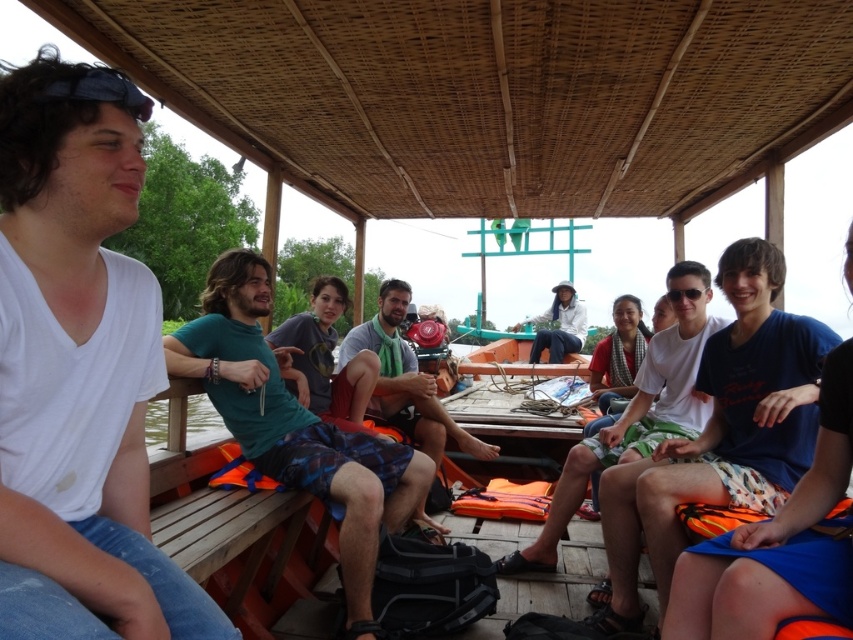
Question: Which is nearer to the blue cotton shorts at center?

Choices:
 (A) white fabric shirt at center
 (B) green fabric shorts at center
 (C) green fabric scarf at center
 (D) white cotton shirt at center

Answer: (D)

Question: Which object appears farthest from the camera in this image?

Choices:
 (A) green fabric shorts at center
 (B) white cotton shirt at left
 (C) white fabric shirt at center
 (D) blue cotton shorts at center

Answer: (C)

Question: Is white cotton shirt at left positioned behind white fabric shirt at center?

Choices:
 (A) no
 (B) yes

Answer: (A)

Question: Does green fabric shorts at center appear under green fabric scarf at center?

Choices:
 (A) no
 (B) yes

Answer: (A)

Question: Can you confirm if green fabric scarf at center is positioned above white fabric shirt at center?

Choices:
 (A) yes
 (B) no

Answer: (B)

Question: Which point appears farthest from the camera in this image?

Choices:
 (A) (338, 432)
 (B) (567, 346)
 (C) (650, 378)
 (D) (102, 620)

Answer: (B)